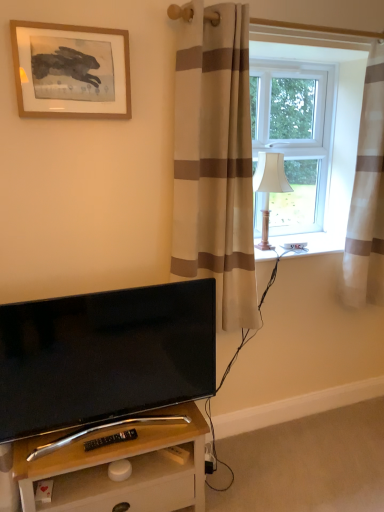
What are the coordinates of `beige striped curtain at center, positioned as the second curtain in right-to-left order` in the screenshot? It's located at (215, 160).

What is the approximate height of wooden desk at lower center?

wooden desk at lower center is 17.40 inches in height.

What do you see at coordinates (110, 439) in the screenshot?
I see `black plastic remote control at lower center` at bounding box center [110, 439].

Locate an element on the screen. This screenshot has width=384, height=512. black glossy tv at lower left is located at coordinates (105, 356).

You are a GUI agent. You are given a task and a screenshot of the screen. Output one action in this format:
    pyautogui.click(x=<x>, y=<y>)
    Task: Click on the transparent glass window at upper right
    Image resolution: width=384 pixels, height=512 pixels.
    Given the screenshot: What is the action you would take?
    pyautogui.click(x=294, y=137)

Measure the distance between wooden frame at upper left and camera.

1.52 meters.

Where is `beige striped curtain at center, placed as the 1th curtain when sorted from left to right`? beige striped curtain at center, placed as the 1th curtain when sorted from left to right is located at coordinates (215, 160).

From a real-world perspective, relative to beige striped curtain at right, the 2th curtain viewed from the left, is beige striped curtain at center, positioned as the second curtain in right-to-left order, vertically above or below?

From a real-world perspective, beige striped curtain at center, positioned as the second curtain in right-to-left order, is physically above beige striped curtain at right, the 2th curtain viewed from the left.

How many degrees apart are the facing directions of beige striped curtain at center, positioned as the second curtain in right-to-left order, and beige striped curtain at right, the 2th curtain viewed from the left?

beige striped curtain at center, positioned as the second curtain in right-to-left order, and beige striped curtain at right, the 2th curtain viewed from the left, are facing 0.00633 degrees away from each other.

Is beige striped curtain at center, positioned as the second curtain in right-to-left order, thinner than beige striped curtain at right, the 2th curtain viewed from the left?

Incorrect, the width of beige striped curtain at center, positioned as the second curtain in right-to-left order, is not less than that of beige striped curtain at right, the 2th curtain viewed from the left.

Would you say beige striped curtain at center, placed as the 1th curtain when sorted from left to right, is to the left or to the right of beige striped curtain at right, the 2th curtain viewed from the left, in the picture?

From the image, it's evident that beige striped curtain at center, placed as the 1th curtain when sorted from left to right, is to the left of beige striped curtain at right, the 2th curtain viewed from the left.

Are wooden desk at lower center and beige striped curtain at center, positioned as the second curtain in right-to-left order, located far from each other?

A: wooden desk at lower center is near beige striped curtain at center, positioned as the second curtain in right-to-left order, not far away.

Can you confirm if wooden desk at lower center is smaller than beige striped curtain at center, placed as the 1th curtain when sorted from left to right?

Indeed, wooden desk at lower center has a smaller size compared to beige striped curtain at center, placed as the 1th curtain when sorted from left to right.

Identify the location of the 1st curtain counting from the right side of the wooden desk at lower center. The height and width of the screenshot is (512, 384). (215, 160).

Is the position of transparent glass window at upper right less distant than that of wooden desk at lower center?

No.

Would you say transparent glass window at upper right is inside or outside wooden desk at lower center?

transparent glass window at upper right is not inside wooden desk at lower center, it's outside.

Is transparent glass window at upper right turned away from wooden desk at lower center?

No, transparent glass window at upper right's orientation is not away from wooden desk at lower center.

Which of these two, transparent glass window at upper right or wooden desk at lower center, is smaller?

transparent glass window at upper right is smaller.

From the wooden desk at lower center, count 1st curtains backward and point to it. Please provide its 2D coordinates.

[(215, 160)]

Which is correct: beige striped curtain at center, placed as the 1th curtain when sorted from left to right, is inside wooden desk at lower center, or outside of it?

beige striped curtain at center, placed as the 1th curtain when sorted from left to right, exists outside the volume of wooden desk at lower center.

Is beige striped curtain at center, positioned as the second curtain in right-to-left order, at the right side of wooden desk at lower center?

Correct, you'll find beige striped curtain at center, positioned as the second curtain in right-to-left order, to the right of wooden desk at lower center.

Is beige striped curtain at center, positioned as the second curtain in right-to-left order, next to wooden desk at lower center?

No, beige striped curtain at center, positioned as the second curtain in right-to-left order, is not next to wooden desk at lower center.

Is transparent glass window at upper right facing towards black plastic remote control at lower center?

No, transparent glass window at upper right is not facing towards black plastic remote control at lower center.

Are transparent glass window at upper right and black plastic remote control at lower center far apart?

Yes, transparent glass window at upper right and black plastic remote control at lower center are located far from each other.

In order to click on remote control in front of the transparent glass window at upper right in this screenshot , I will do `click(110, 439)`.

Which object is wider, transparent glass window at upper right or black glossy tv at lower left?

black glossy tv at lower left is wider.

Are transparent glass window at upper right and black glossy tv at lower left beside each other?

There is a gap between transparent glass window at upper right and black glossy tv at lower left.

Does transparent glass window at upper right appear on the right side of black glossy tv at lower left?

Indeed, transparent glass window at upper right is positioned on the right side of black glossy tv at lower left.

Is beige striped curtain at center, placed as the 1th curtain when sorted from left to right, oriented towards black glossy tv at lower left?

No, beige striped curtain at center, placed as the 1th curtain when sorted from left to right, is not aimed at black glossy tv at lower left.

Between beige striped curtain at center, placed as the 1th curtain when sorted from left to right, and black glossy tv at lower left, which one has smaller width?

black glossy tv at lower left.

Can you confirm if beige striped curtain at center, positioned as the second curtain in right-to-left order, is positioned to the left of black glossy tv at lower left?

No, beige striped curtain at center, positioned as the second curtain in right-to-left order, is not to the left of black glossy tv at lower left.

Find the location of a particular element. The height and width of the screenshot is (512, 384). curtain above the beige striped curtain at right, the 2th curtain viewed from the left (from a real-world perspective) is located at coordinates (215, 160).

This screenshot has width=384, height=512. Find the location of `desk below the beige striped curtain at center, placed as the 1th curtain when sorted from left to right (from the image's perspective)`. desk below the beige striped curtain at center, placed as the 1th curtain when sorted from left to right (from the image's perspective) is located at coordinates coord(120,459).

Estimate the real-world distances between objects in this image. Which object is closer to beige striped curtain at right, the 2th curtain viewed from the left, black glossy tv at lower left or black plastic remote control at lower center?

black glossy tv at lower left is positioned closer to the anchor beige striped curtain at right, the 2th curtain viewed from the left.

Estimate the real-world distances between objects in this image. Which object is closer to black plastic remote control at lower center, wooden desk at lower center or white fabric lampshade at right?

wooden desk at lower center is positioned closer to the anchor black plastic remote control at lower center.

Looking at the image, which one is located closer to transparent glass window at upper right, wooden frame at upper left or beige striped curtain at center, positioned as the second curtain in right-to-left order?

beige striped curtain at center, positioned as the second curtain in right-to-left order.

When comparing their distances from white fabric lampshade at right, does black glossy tv at lower left or beige striped curtain at center, placed as the 1th curtain when sorted from left to right, seem closer?

Among the two, beige striped curtain at center, placed as the 1th curtain when sorted from left to right, is located nearer to white fabric lampshade at right.

From the image, which object appears to be farther from beige striped curtain at right, marked as the 1th curtain in a right-to-left arrangement, transparent glass window at upper right or white fabric lampshade at right?

white fabric lampshade at right lies further to beige striped curtain at right, marked as the 1th curtain in a right-to-left arrangement, than the other object.

From the image, which object appears to be farther from white fabric lampshade at right, beige striped curtain at right, marked as the 1th curtain in a right-to-left arrangement, or transparent glass window at upper right?

beige striped curtain at right, marked as the 1th curtain in a right-to-left arrangement, is further to white fabric lampshade at right.

When comparing their distances from beige striped curtain at right, the 2th curtain viewed from the left, does wooden frame at upper left or wooden desk at lower center seem further?

wooden frame at upper left lies further to beige striped curtain at right, the 2th curtain viewed from the left, than the other object.

Looking at the image, which one is located closer to wooden desk at lower center, wooden frame at upper left or black glossy tv at lower left?

black glossy tv at lower left is closer to wooden desk at lower center.

This screenshot has height=512, width=384. Identify the location of window screen between black glossy tv at lower left and beige striped curtain at right, marked as the 1th curtain in a right-to-left arrangement, from left to right. (294, 137).

This screenshot has height=512, width=384. What are the coordinates of `lamp between beige striped curtain at center, positioned as the second curtain in right-to-left order, and wooden desk at lower center from top to bottom` in the screenshot? It's located at (269, 187).

Where is `window screen between wooden frame at upper left and black glossy tv at lower left vertically`? This screenshot has height=512, width=384. window screen between wooden frame at upper left and black glossy tv at lower left vertically is located at coordinates (294, 137).

The height and width of the screenshot is (512, 384). Identify the location of lamp between black glossy tv at lower left and beige striped curtain at right, marked as the 1th curtain in a right-to-left arrangement. (269, 187).